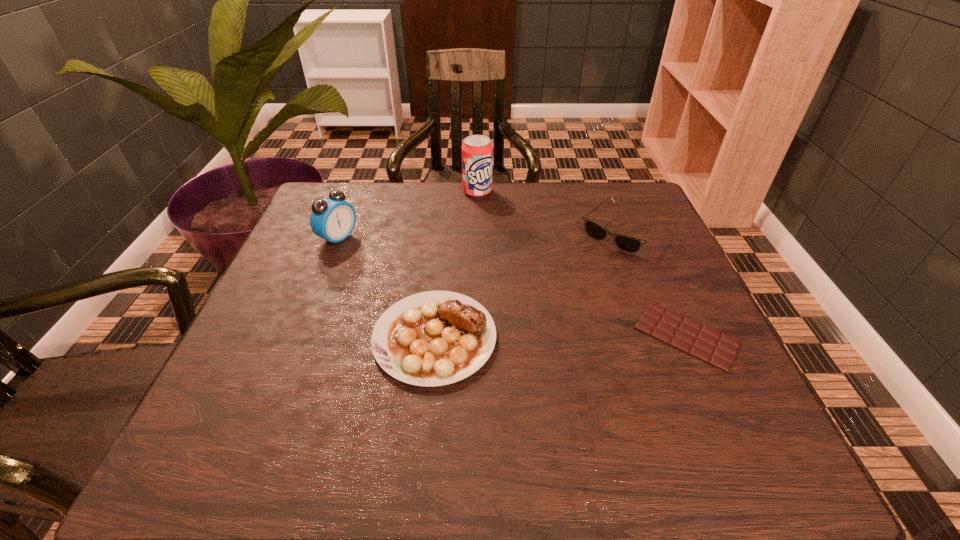
Locate an element on the screen. This screenshot has width=960, height=540. vacant space on the desktop that is between the steak and the chocolate bar and is positioned on the face of the second tallest object is located at coordinates (551, 336).

Identify the location of free space on the desktop that is between the steak and the shortest object and is positioned on the surface of the tallest object. (551, 336).

Where is `vacant spot on the desktop that is between the steak and the chocolate bar and is positioned on the lenses of the sunglasses`? This screenshot has width=960, height=540. vacant spot on the desktop that is between the steak and the chocolate bar and is positioned on the lenses of the sunglasses is located at coordinates (523, 337).